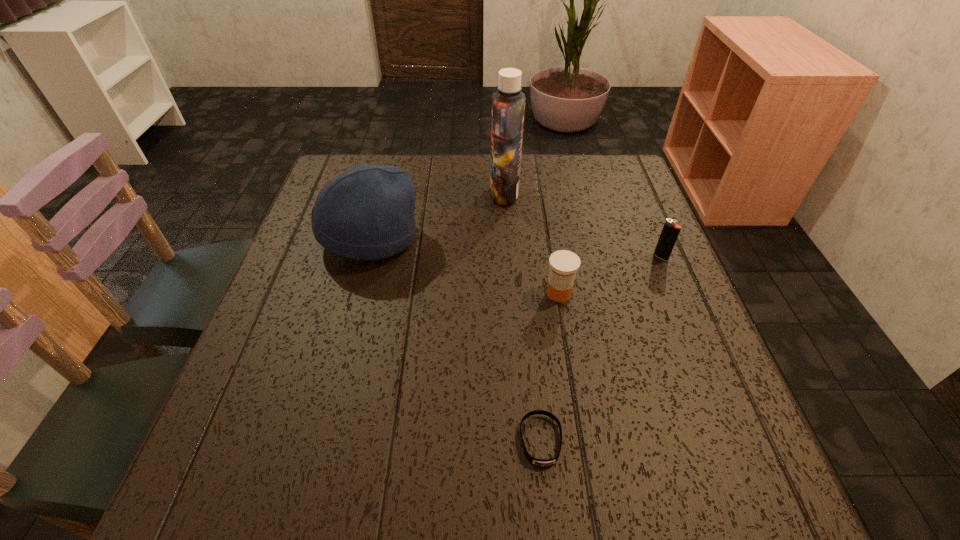
This screenshot has width=960, height=540. What are the coordinates of `vacant area that lies between the tallest object and the igniter` in the screenshot? It's located at (583, 225).

Find the location of a particular element. vacant area that lies between the igniter and the tallest object is located at coordinates (583, 225).

I want to click on free spot between the second object from right to left and the tallest object, so click(x=532, y=243).

Select which object appears as the fourth closest to the rightmost object. Please provide its 2D coordinates. Your answer should be formatted as a tuple, i.e. [(x, y)], where the tuple contains the x and y coordinates of a point satisfying the conditions above.

[(367, 212)]

The height and width of the screenshot is (540, 960). I want to click on object that can be found as the fourth closest to the rightmost object, so click(x=367, y=212).

Image resolution: width=960 pixels, height=540 pixels. In order to click on blank area in the image that satisfies the following two spatial constraints: 1. on the front side of the rightmost object; 2. on the left side of the fourth shortest object in this screenshot , I will do `click(365, 257)`.